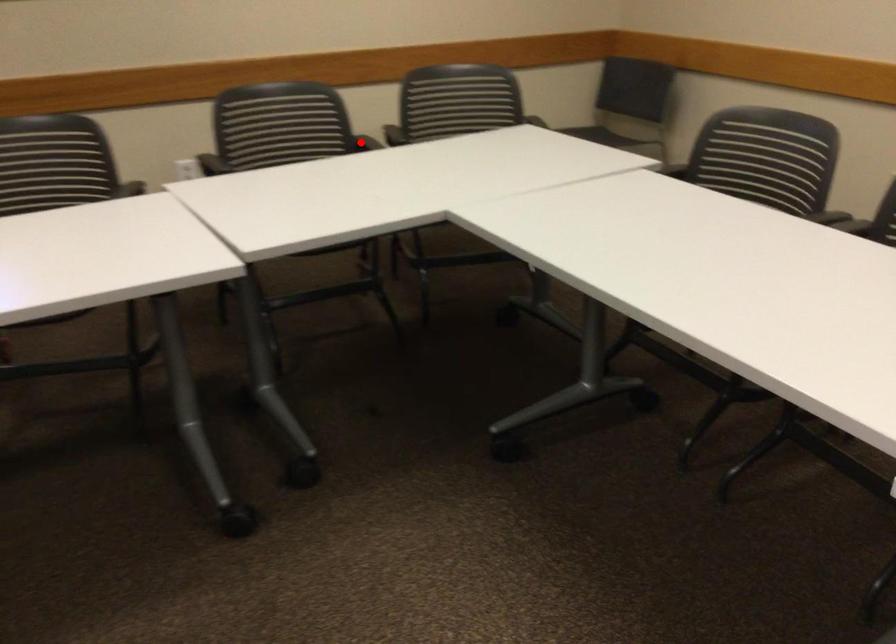
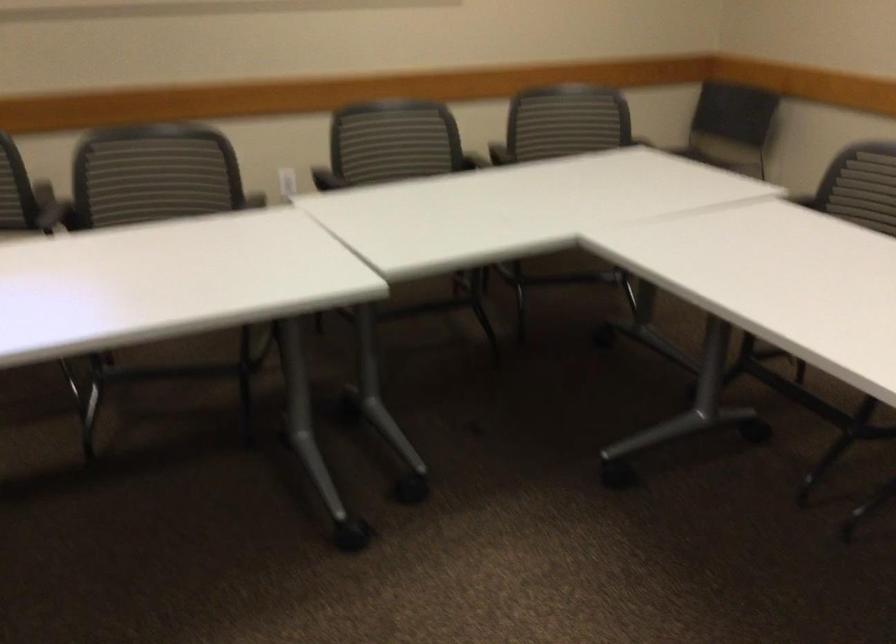
Question: I am providing you with two images of the same scene from different viewpoints. A red point is marked on the first image. Can you still see the location of the red point in image 2?

Choices:
 (A) Yes
 (B) No

Answer: (B)